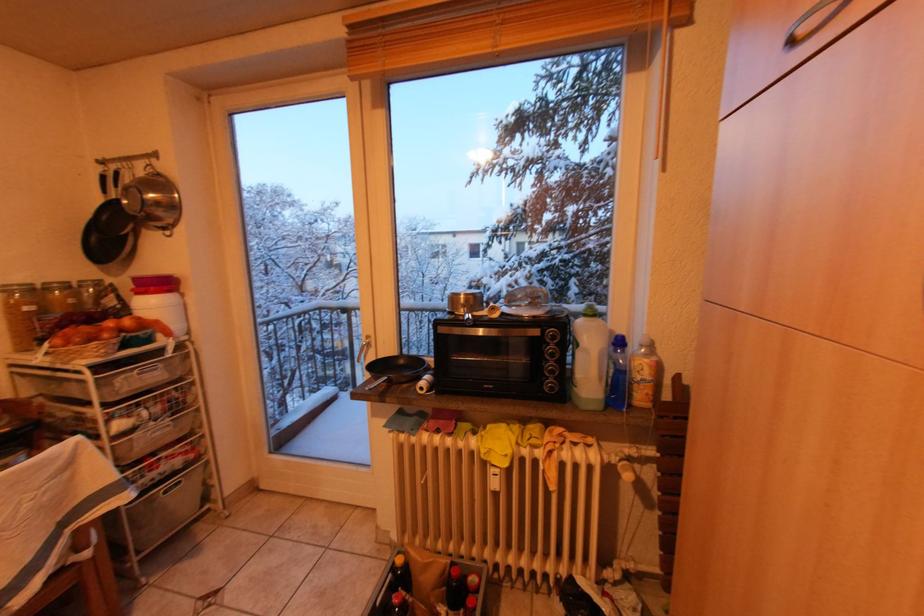
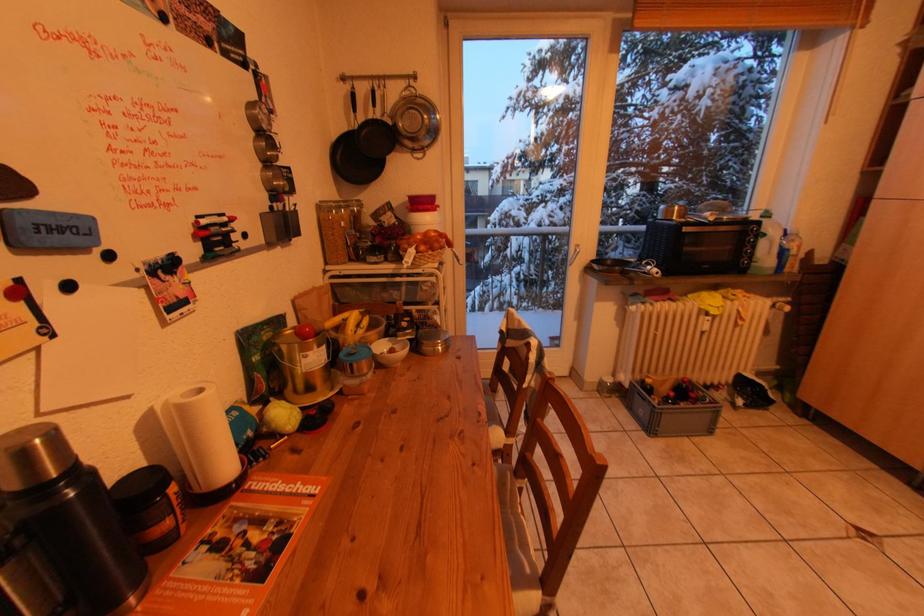
Question: What movement of the cameraman would produce the second image?

Choices:
 (A) Left
 (B) Right
 (C) Forward
 (D) Backward

Answer: (A)